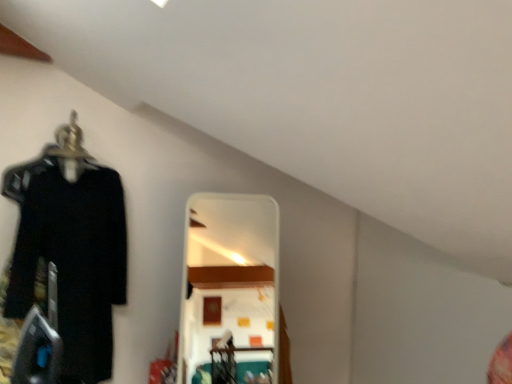
Question: Relative to metallic silver hanger at left, is black matte shirt at left in front or behind?

Choices:
 (A) front
 (B) behind

Answer: (A)

Question: From a real-world perspective, is black matte shirt at left physically located above or below metallic silver hanger at left?

Choices:
 (A) below
 (B) above

Answer: (A)

Question: Is point 88,187 closer or farther from the camera than point 64,132?

Choices:
 (A) farther
 (B) closer

Answer: (B)

Question: Relative to black matte shirt at left, is metallic silver hanger at left in front or behind?

Choices:
 (A) behind
 (B) front

Answer: (A)

Question: Does point (55, 130) appear closer or farther from the camera than point (120, 253)?

Choices:
 (A) farther
 (B) closer

Answer: (B)

Question: From a real-world perspective, is metallic silver hanger at left above or below black matte shirt at left?

Choices:
 (A) above
 (B) below

Answer: (A)

Question: Is metallic silver hanger at left inside or outside of black matte shirt at left?

Choices:
 (A) inside
 (B) outside

Answer: (B)